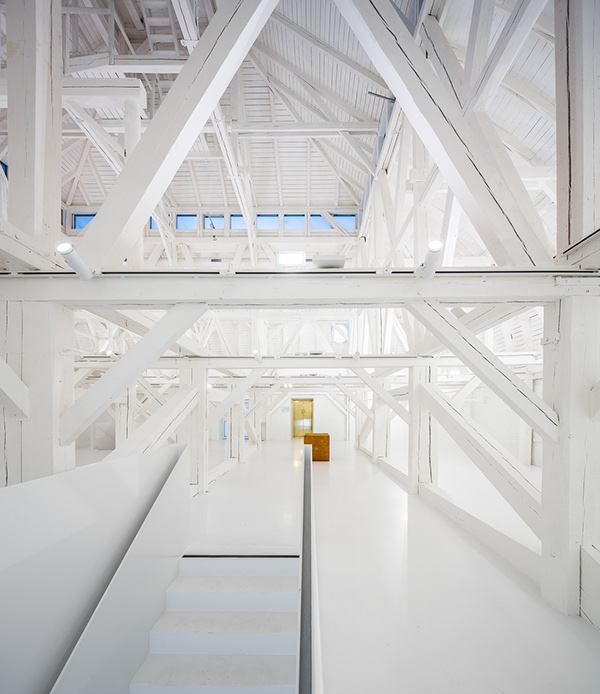
In order to click on entry in this screenshot , I will do `click(298, 413)`.